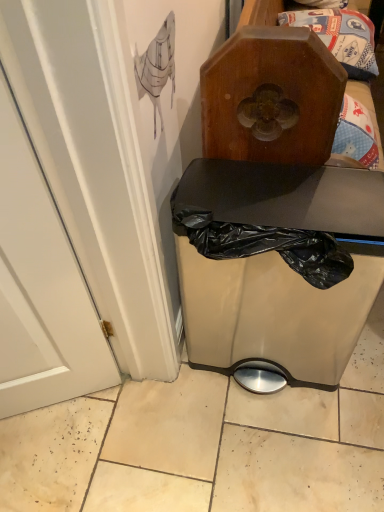
In order to face wooden box at upper center, should I rotate leftwards or rightwards?

A 17.724 degree turn to the right will do.

What is the approximate height of wooden box at upper center?

wooden box at upper center is 8.95 inches in height.

Where is `wooden box at upper center`? The height and width of the screenshot is (512, 384). wooden box at upper center is located at coordinates (340, 37).

This screenshot has height=512, width=384. Describe the element at coordinates (340, 37) in the screenshot. I see `wooden box at upper center` at that location.

Describe the element at coordinates (276, 268) in the screenshot. This screenshot has height=512, width=384. I see `matte black trash can at center` at that location.

Identify the location of matte black trash can at center. (276, 268).

Find the location of a particular element. The height and width of the screenshot is (512, 384). wooden box at upper center is located at coordinates (340, 37).

Which is more to the left, matte black trash can at center or wooden box at upper center?

wooden box at upper center.

Considering the positions of objects matte black trash can at center and wooden box at upper center in the image provided, who is in front, matte black trash can at center or wooden box at upper center?

matte black trash can at center is in front.

Does point (251, 317) come farther from viewer compared to point (356, 57)?

No, (251, 317) is in front of (356, 57).

From the image's perspective, is matte black trash can at center below wooden box at upper center?

No, from the image's perspective, matte black trash can at center is not beneath wooden box at upper center.

From a real-world perspective, is matte black trash can at center physically above wooden box at upper center?

Incorrect, from a real-world perspective, matte black trash can at center is lower than wooden box at upper center.

Does matte black trash can at center have a greater width compared to wooden box at upper center?

Yes.

Can you confirm if matte black trash can at center is taller than wooden box at upper center?

Correct, matte black trash can at center is much taller as wooden box at upper center.

Who is bigger, matte black trash can at center or wooden box at upper center?

matte black trash can at center is bigger.

Is wooden box at upper center completely or partially inside matte black trash can at center?

Yes, wooden box at upper center is surrounded by matte black trash can at center.

Is matte black trash can at center not close to wooden box at upper center?

matte black trash can at center is near wooden box at upper center, not far away.

Is matte black trash can at center looking in the opposite direction of wooden box at upper center?

Yes, matte black trash can at center is positioned with its back facing wooden box at upper center.

The height and width of the screenshot is (512, 384). Identify the location of waste on the left side of matte black trash can at center. (340, 37).

Would you say wooden box at upper center is to the left or to the right of matte black trash can at center in the picture?

Based on their positions, wooden box at upper center is located to the left of matte black trash can at center.

Is the depth of wooden box at upper center greater than that of matte black trash can at center?

Yes.

Considering the positions of points (371, 56) and (196, 332), is point (371, 56) closer to camera compared to point (196, 332)?

No, (371, 56) is behind (196, 332).

From the image's perspective, which object appears higher, wooden box at upper center or matte black trash can at center?

From the image's view, matte black trash can at center is above.

From a real-world perspective, who is located lower, wooden box at upper center or matte black trash can at center?

In real-world perspective, matte black trash can at center is lower.

Considering the sizes of wooden box at upper center and matte black trash can at center in the image, is wooden box at upper center wider or thinner than matte black trash can at center?

Considering their sizes, wooden box at upper center looks slimmer than matte black trash can at center.

Who is taller, wooden box at upper center or matte black trash can at center?

With more height is matte black trash can at center.

Can you confirm if wooden box at upper center is bigger than matte black trash can at center?

Actually, wooden box at upper center might be smaller than matte black trash can at center.

Is wooden box at upper center inside the boundaries of matte black trash can at center, or outside?

wooden box at upper center is contained in matte black trash can at center.

Based on the photo, is wooden box at upper center next to matte black trash can at center and touching it?

No, wooden box at upper center is not beside matte black trash can at center.

Could you tell me if wooden box at upper center is turned towards matte black trash can at center?

Yes, wooden box at upper center faces towards matte black trash can at center.

How different are the orientations of wooden box at upper center and matte black trash can at center in degrees?

wooden box at upper center and matte black trash can at center are facing 0.911 degrees away from each other.

Locate an element on the screen. The image size is (384, 512). furniture below the wooden box at upper center (from a real-world perspective) is located at coordinates (276, 268).

I want to click on waste located behind the matte black trash can at center, so click(340, 37).

Locate an element on the screen. This screenshot has width=384, height=512. furniture that is above the wooden box at upper center (from the image's perspective) is located at coordinates (276, 268).